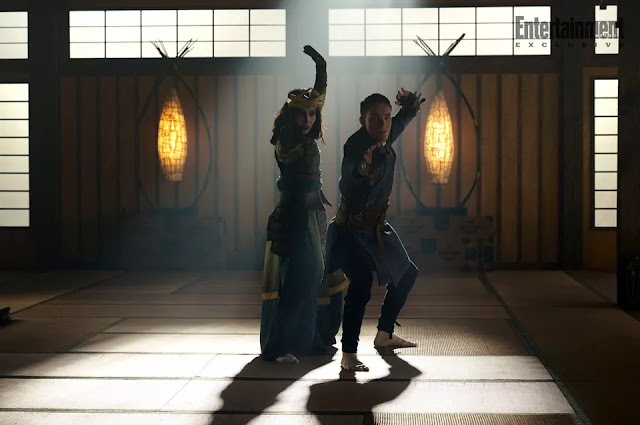
At what (x,y) coordinates should I click in order to perform the action: click on hanging lamp shades. Please return your answer as a coordinate pair (x, y). This screenshot has width=640, height=425. Looking at the image, I should click on (169, 129), (444, 134).